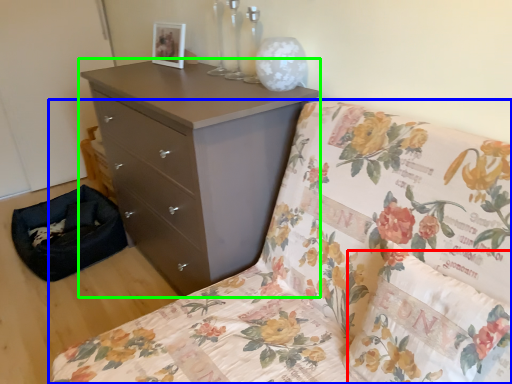
Question: Considering the real-world distances, which object is farthest from pillow (highlighted by a red box)? furniture (highlighted by a blue box) or chest of drawers (highlighted by a green box)?

Choices:
 (A) furniture
 (B) chest of drawers

Answer: (B)